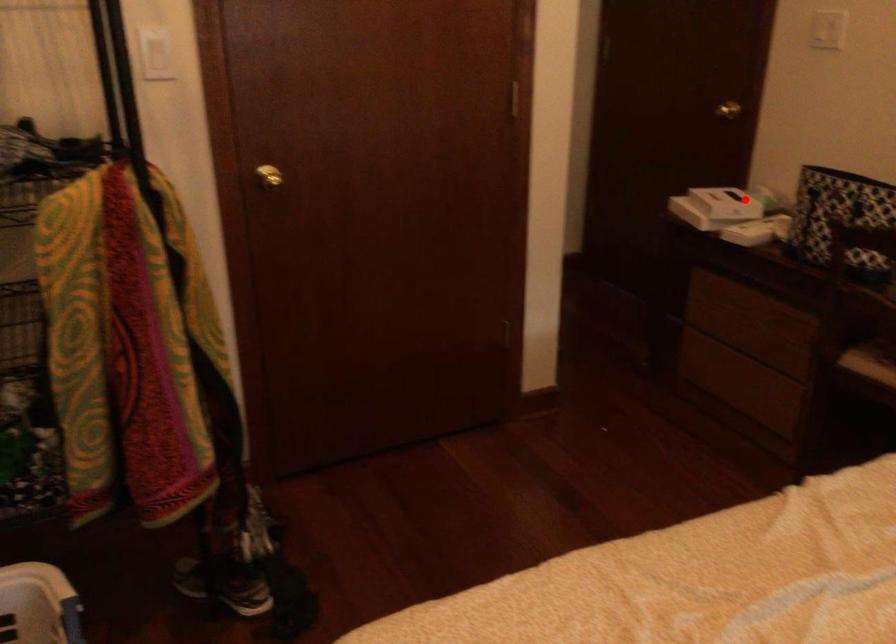
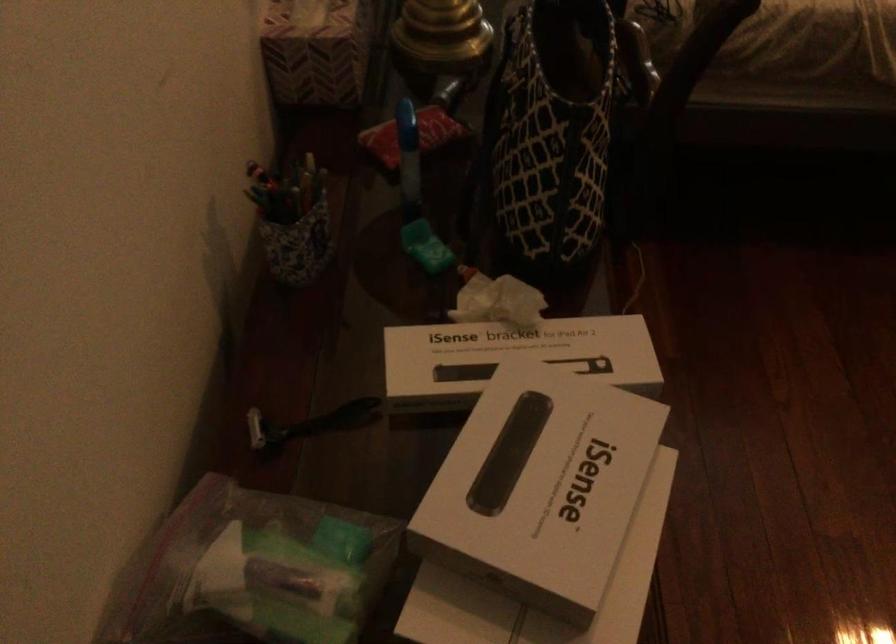
Find the pixel in the second image that matches the highlighted location in the first image.

(515, 353)